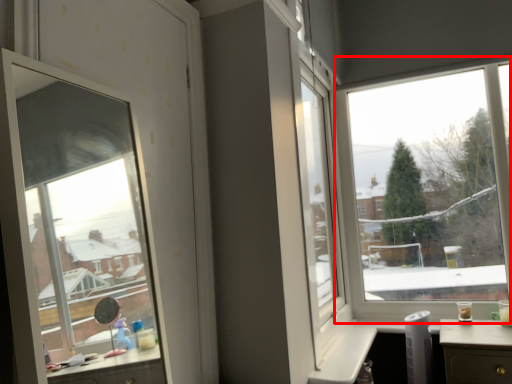
Question: From the image's perspective, what is the correct spatial relationship of window (annotated by the red box) in relation to window?

Choices:
 (A) above
 (B) below

Answer: (B)